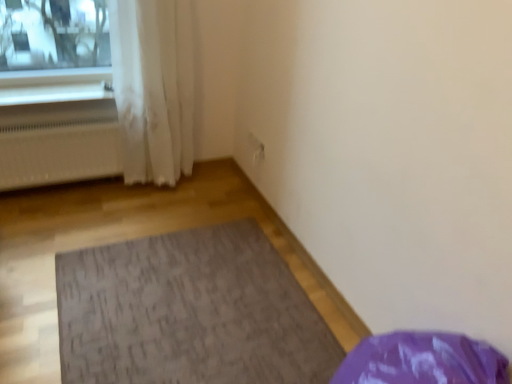
I want to click on free area below white matte radiator at left (from a real-world perspective), so click(x=62, y=184).